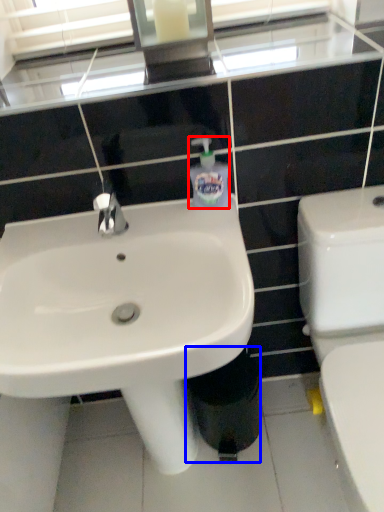
Question: Which object is further to the camera taking this photo, toiletries (highlighted by a red box) or trash bin/can (highlighted by a blue box)?

Choices:
 (A) toiletries
 (B) trash bin/can

Answer: (B)